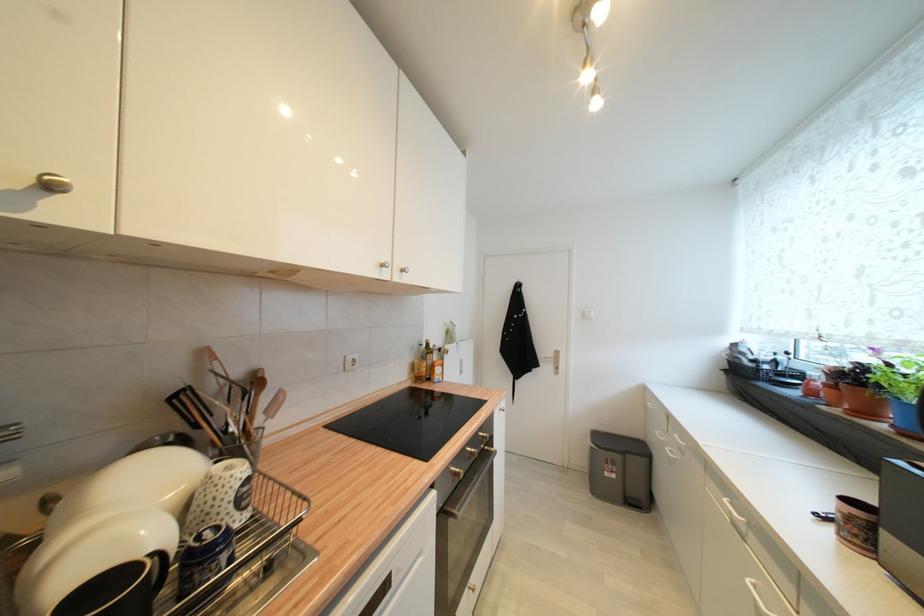
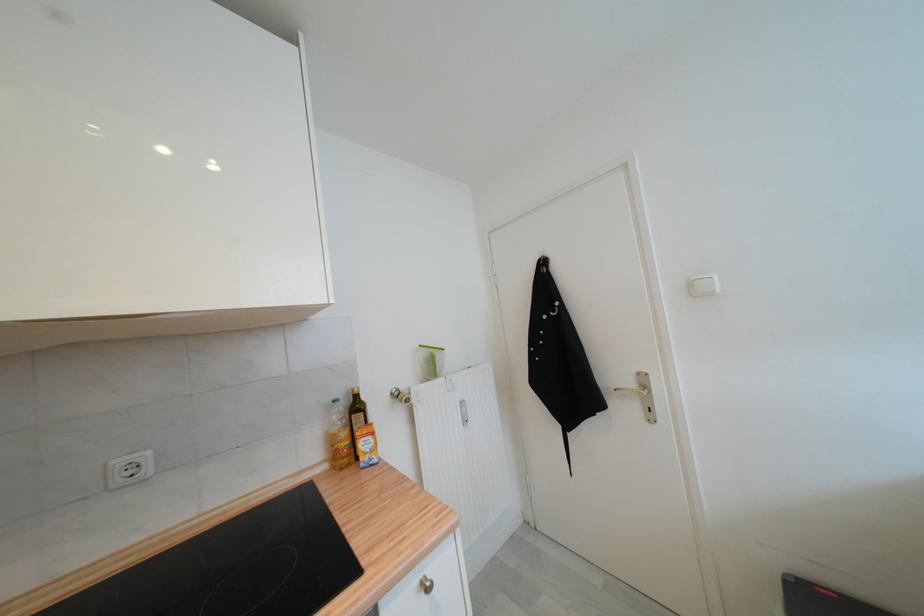
Locate, in the second image, the point that corresponds to the point at 355,359 in the first image.

(126, 464)